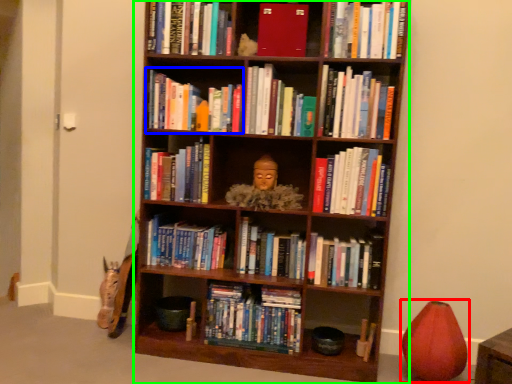
Question: Which is farther away from toy (highlighted by a red box)? book (highlighted by a blue box) or bookcase (highlighted by a green box)?

Choices:
 (A) book
 (B) bookcase

Answer: (A)